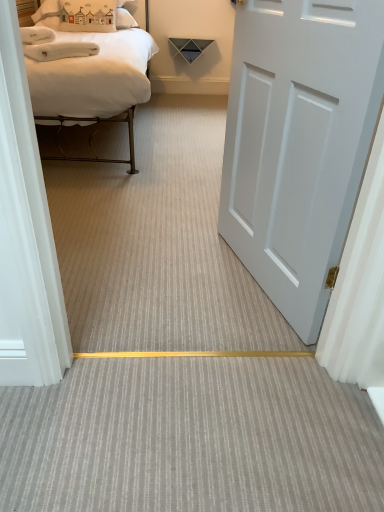
Identify the location of vacant space situated on the left part of white matte door at right. (165, 269).